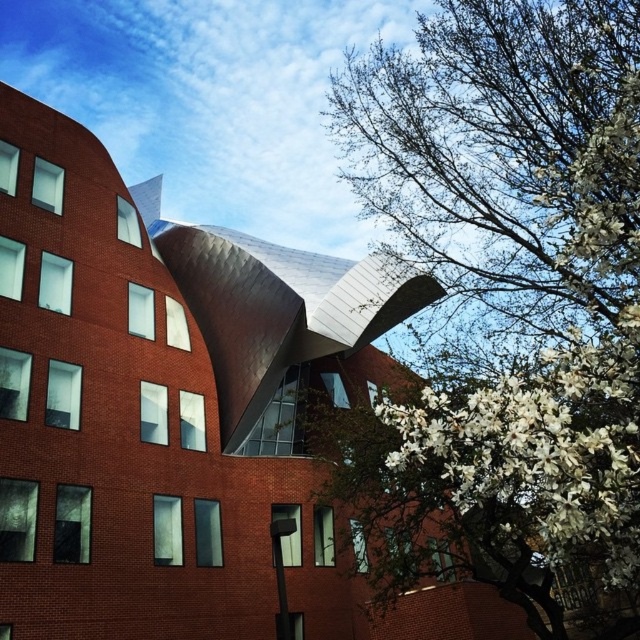
Question: Is white blossoms at upper right thinner than white fluffy petals at right?

Choices:
 (A) yes
 (B) no

Answer: (B)

Question: Does white blossoms at upper right appear on the left side of white fluffy petals at right?

Choices:
 (A) yes
 (B) no

Answer: (B)

Question: Is white blossoms at upper right to the right of white fluffy petals at right from the viewer's perspective?

Choices:
 (A) yes
 (B) no

Answer: (A)

Question: Among these objects, which one is farthest from the camera?

Choices:
 (A) white blossoms at upper right
 (B) white fluffy petals at right

Answer: (A)

Question: Which point is closer to the camera?

Choices:
 (A) white blossoms at upper right
 (B) white fluffy petals at right

Answer: (B)